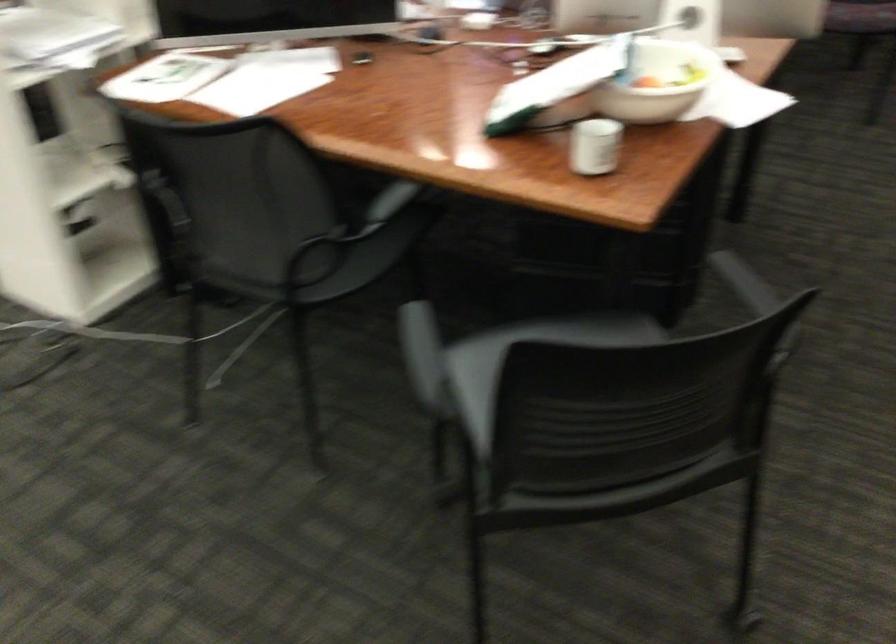
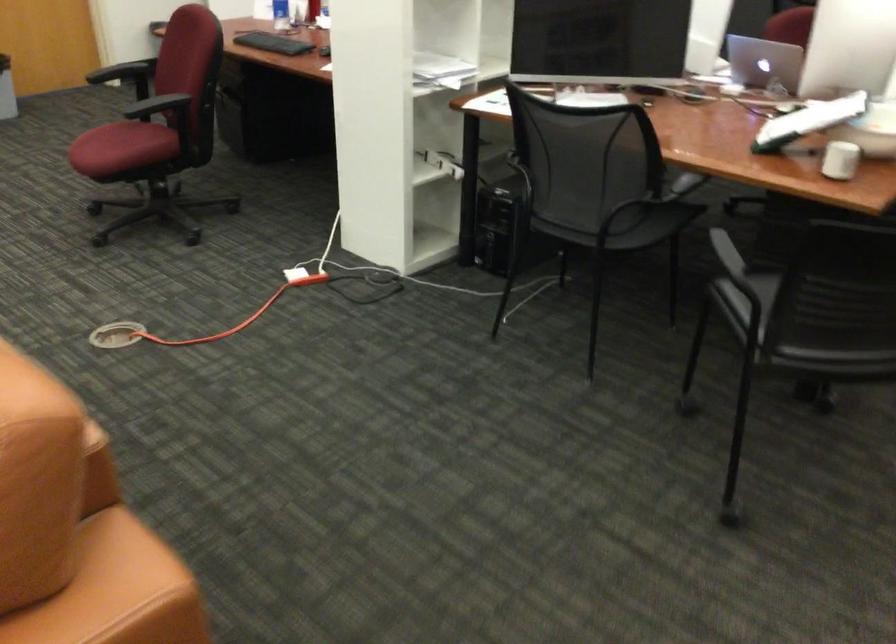
Question: I am providing you with two images of the same scene from different viewpoints. After the viewpoint changes to image2, which objects are now occluded?

Choices:
 (A) white ceramic cup
 (B) red file organizer
 (C) red chair sitting surface
 (D) chair sitting surface

Answer: (D)